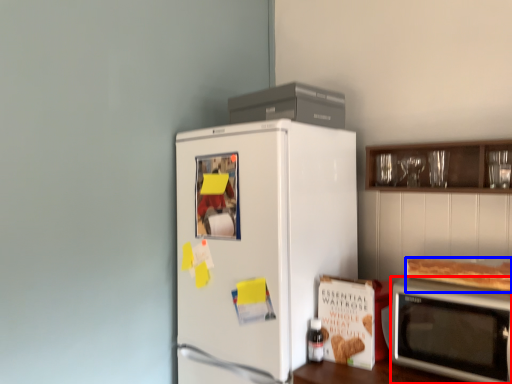
Question: Among these objects, which one is farthest to the camera, microwave oven (highlighted by a red box) or food (highlighted by a blue box)?

Choices:
 (A) microwave oven
 (B) food

Answer: (B)